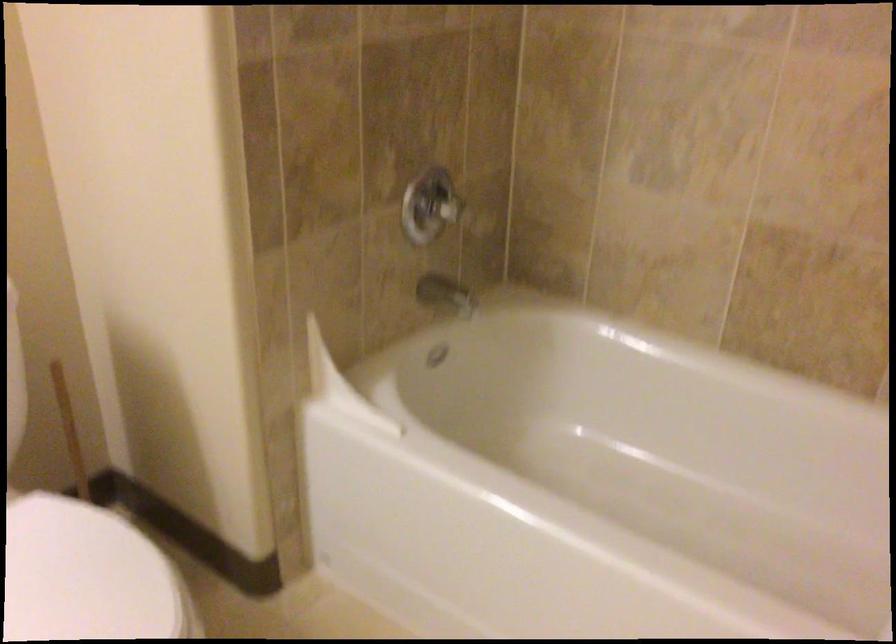
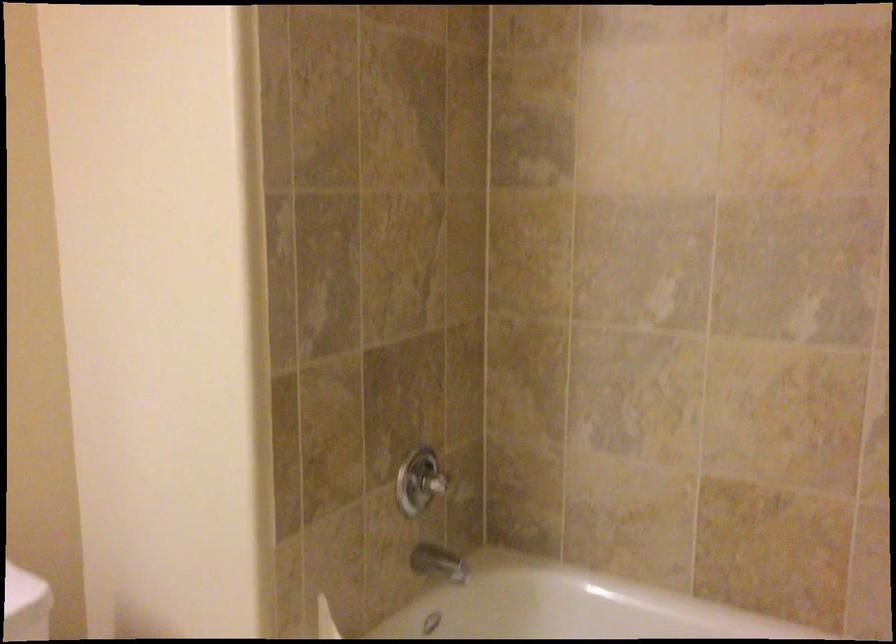
Question: The images are taken continuously from a first-person perspective. In which direction is your viewpoint rotating?

Choices:
 (A) Left
 (B) Right
 (C) Up
 (D) Down

Answer: (C)